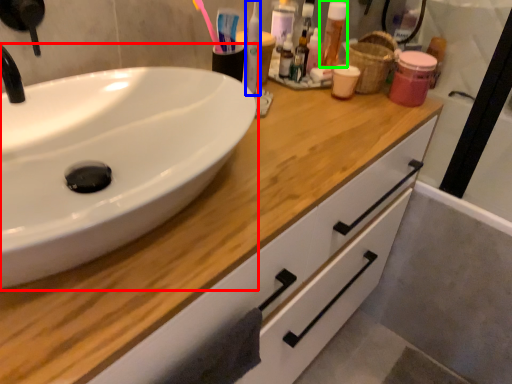
Question: Which object is positioned farthest from sink (highlighted by a red box)? Select from mouthwash (highlighted by a blue box) and mouthwash (highlighted by a green box).

Choices:
 (A) mouthwash
 (B) mouthwash

Answer: (B)